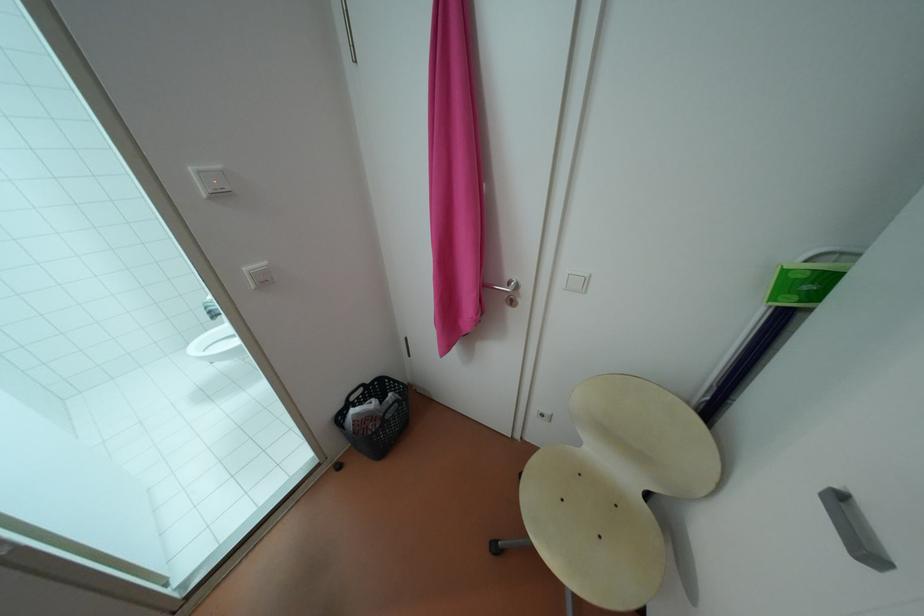
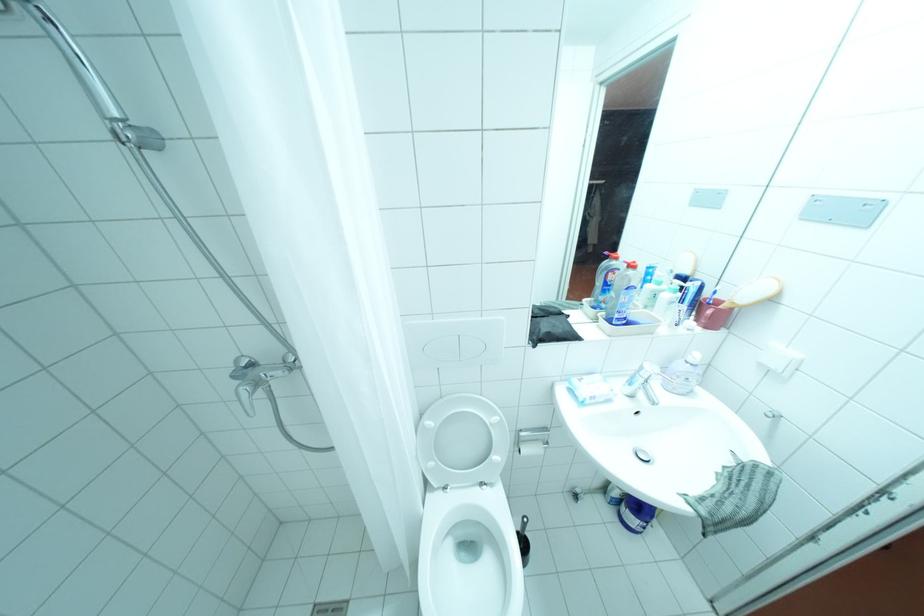
Question: I am providing you with two images of the same scene from different viewpoints. After the viewpoint changes to image2, which objects are now occluded?

Choices:
 (A) grey floor pillow
 (B) black basket handle
 (C) white toilet lid
 (D) shower faucet handle

Answer: (B)